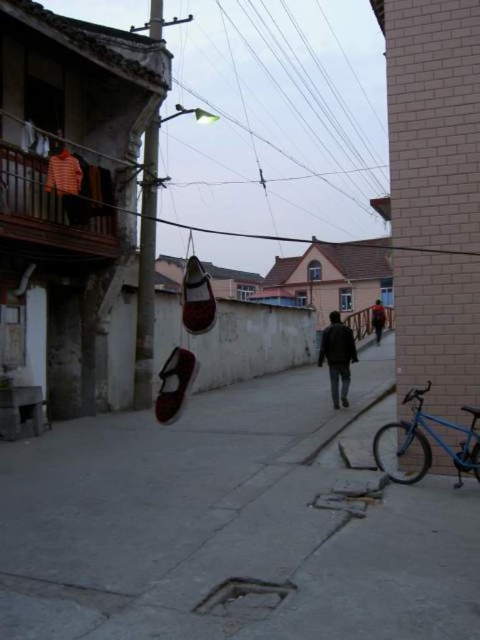
You are a delivery person trying to navigate through the narrow alleyway. You need to place a large package on the ground. Which object, the concrete sidewalk at center or the dark brown leather jacket at center, would be a more suitable surface for placing the package?

The concrete sidewalk at center is bigger than the dark brown leather jacket at center, so the concrete sidewalk at center would be a more suitable surface for placing the large package because it has more space.